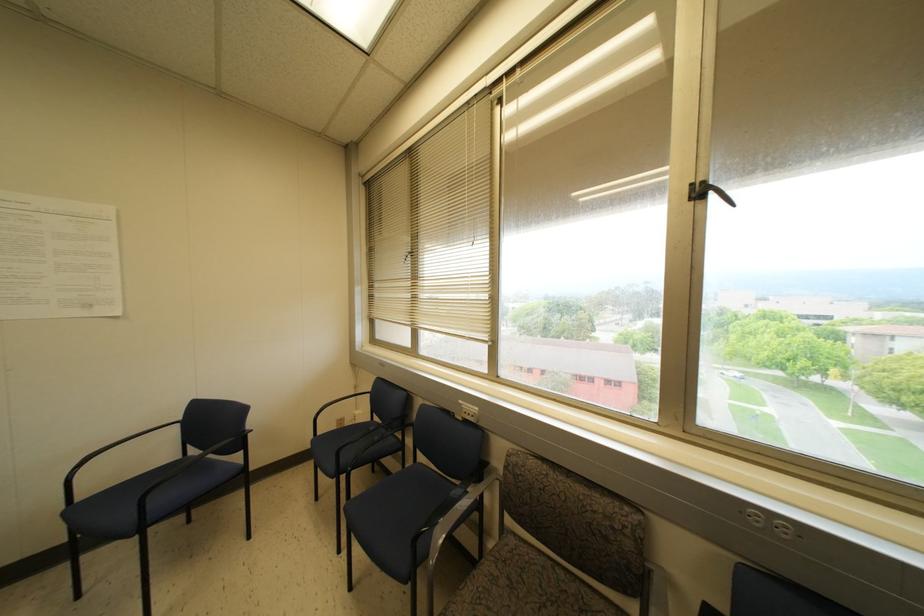
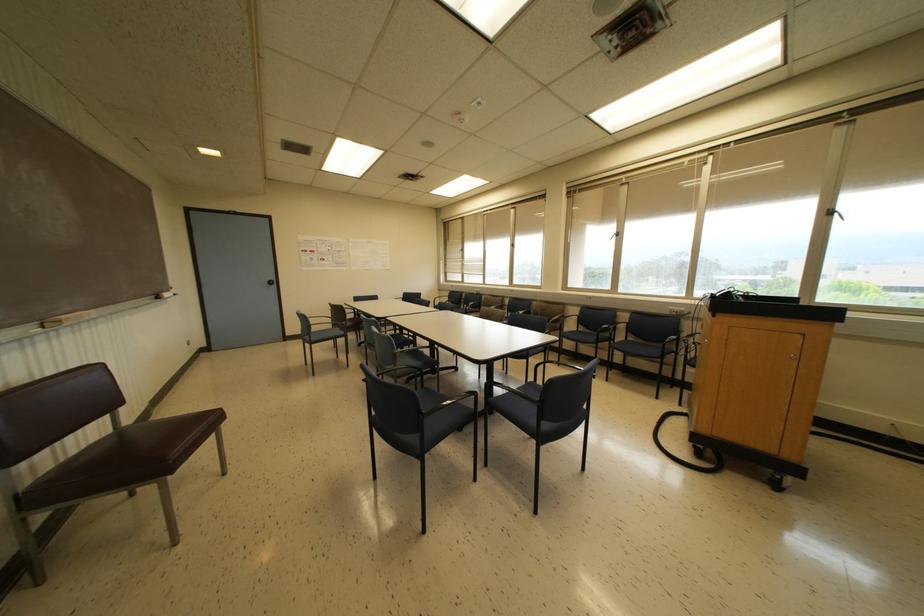
Question: I am providing you with two images of the same scene from different viewpoints. After the viewpoint changes to image2, which objects are now occluded?

Choices:
 (A) black window crank
 (B) black window handle
 (C) blue chair sitting surface
 (D) blue plastic object

Answer: (B)